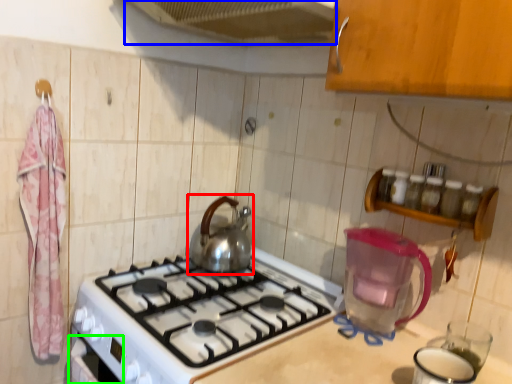
Question: Estimate the real-world distances between objects in this image. Which object is closer to kettle (highlighted by a red box), exhaust hood (highlighted by a blue box) or oven (highlighted by a green box)?

Choices:
 (A) exhaust hood
 (B) oven

Answer: (B)